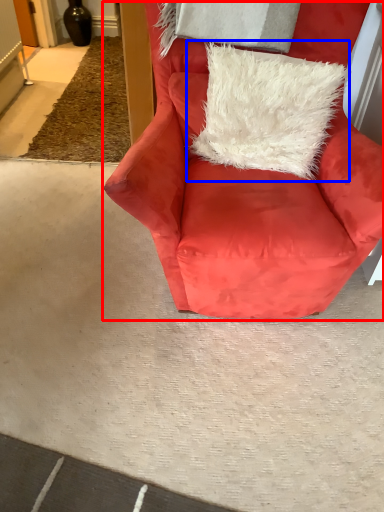
Question: Which object is closer to the camera taking this photo, chair (highlighted by a red box) or pillow (highlighted by a blue box)?

Choices:
 (A) chair
 (B) pillow

Answer: (A)